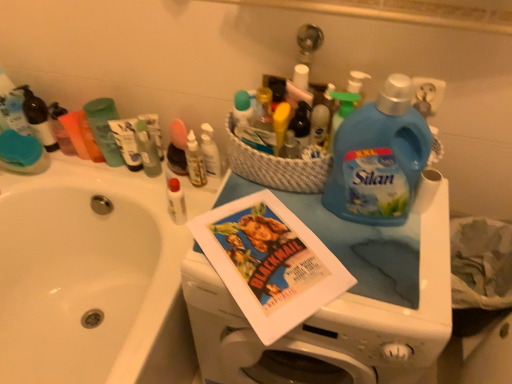
Where is `vacant space to the right of matte paper comic book at center`? vacant space to the right of matte paper comic book at center is located at coordinates (399, 276).